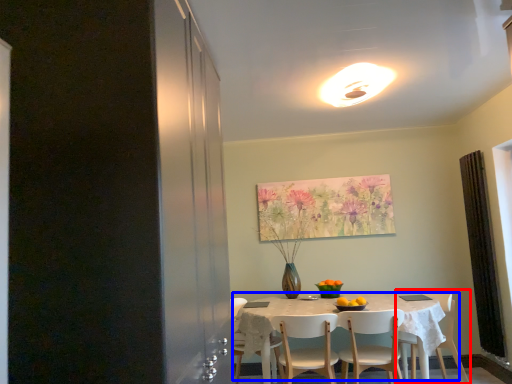
Question: Which object is further to the camera taking this photo, chair (highlighted by a red box) or kitchen & dining room table (highlighted by a blue box)?

Choices:
 (A) chair
 (B) kitchen & dining room table

Answer: (A)